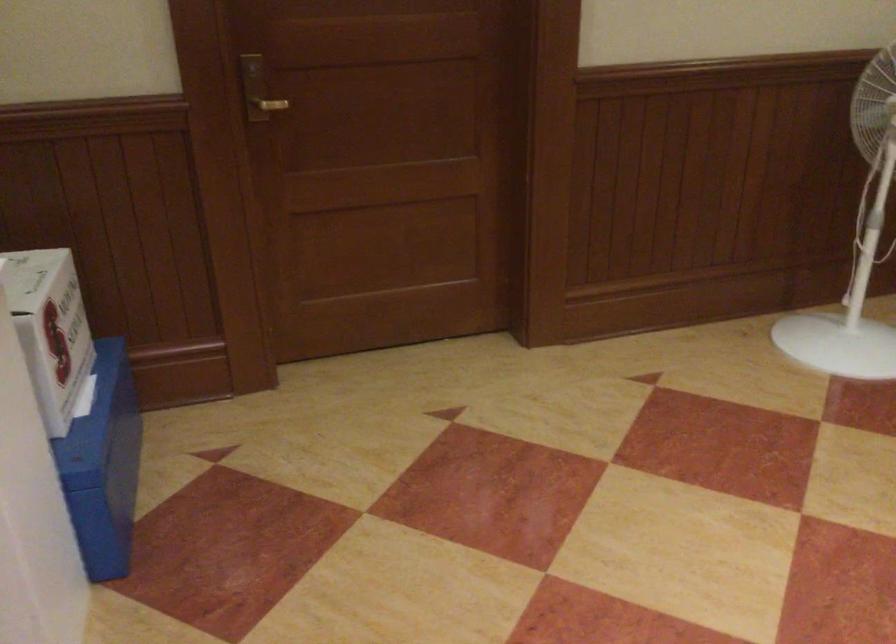
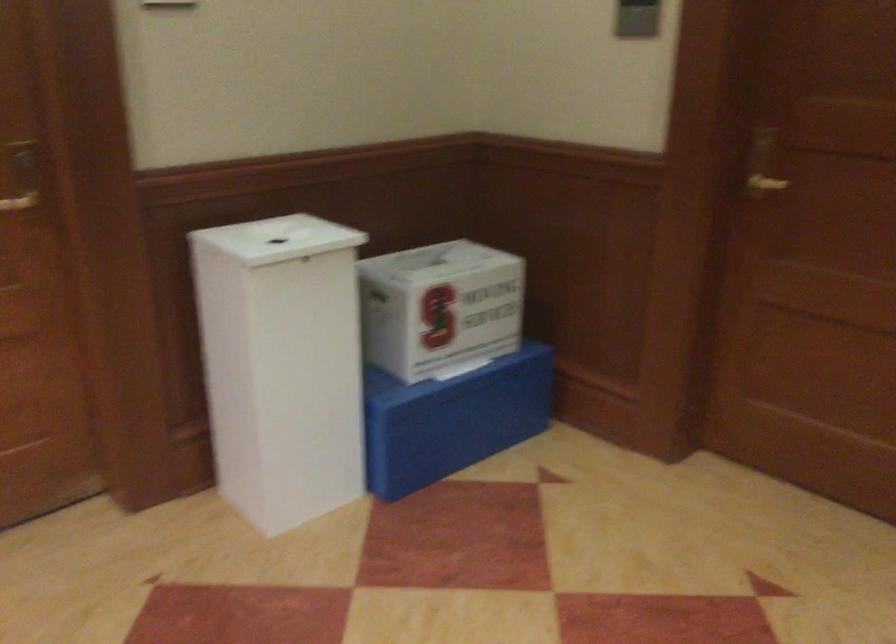
Locate, in the second image, the point that corresponds to the point at 116,449 in the first image.

(452, 419)